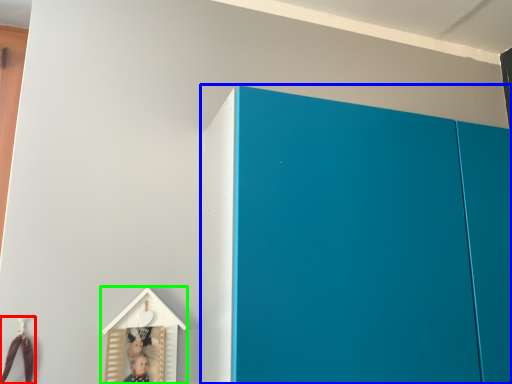
Question: Considering the real-world distances, which object is closest to toy (highlighted by a red box)? cupboard (highlighted by a blue box) or toy (highlighted by a green box).

Choices:
 (A) cupboard
 (B) toy

Answer: (B)